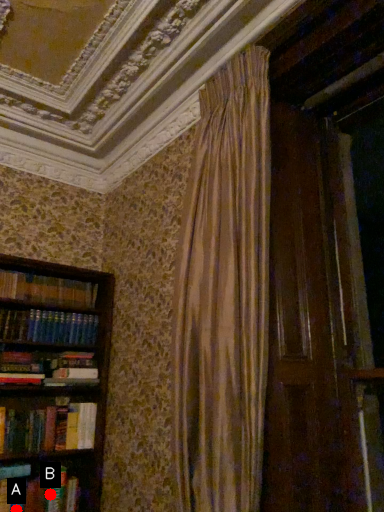
Question: Two points are circled on the image, labeled by A and B beside each circle. Which of the following is the farthest from the observer?

Choices:
 (A) A is further
 (B) B is further

Answer: (B)